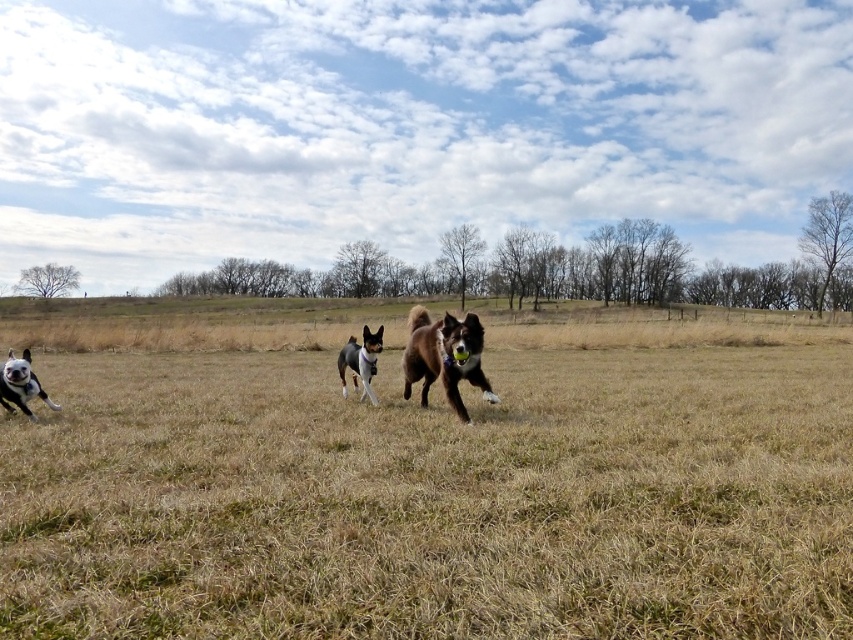
Question: Estimate the real-world distances between objects in this image. Which object is farther from the smooth brown dog at center?

Choices:
 (A) brown grass at center
 (B) brown furry dog at center
 (C) white glossy dog at lower left

Answer: (A)

Question: Is brown furry dog at center above white glossy dog at lower left?

Choices:
 (A) no
 (B) yes

Answer: (B)

Question: Is brown furry dog at center bigger than white glossy dog at lower left?

Choices:
 (A) yes
 (B) no

Answer: (A)

Question: Which object is the closest to the white glossy dog at lower left?

Choices:
 (A) smooth brown dog at center
 (B) brown furry dog at center
 (C) brown grass at center

Answer: (A)

Question: Which of these objects is positioned closest to the white glossy dog at lower left?

Choices:
 (A) brown furry dog at center
 (B) smooth brown dog at center

Answer: (B)

Question: In this image, where is brown furry dog at center located relative to smooth brown dog at center?

Choices:
 (A) right
 (B) left

Answer: (A)